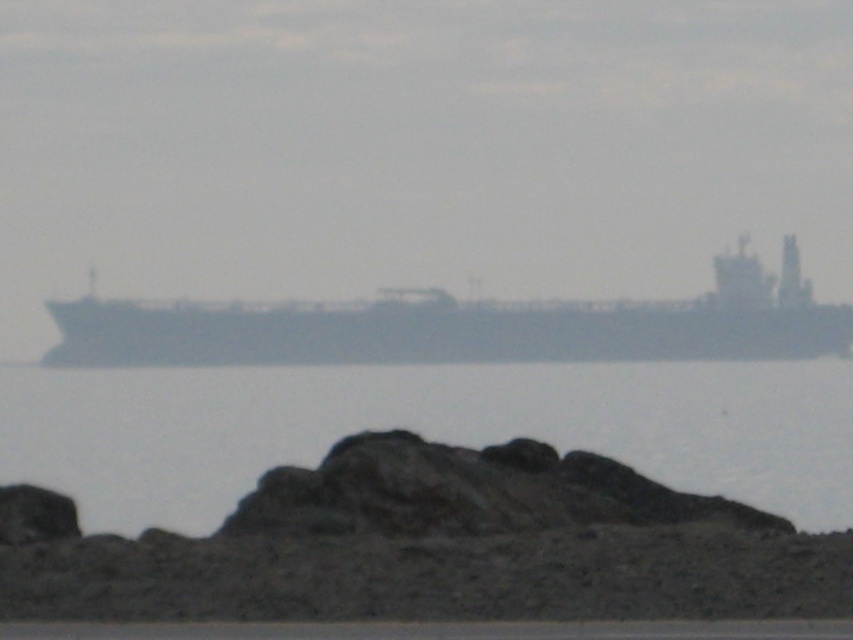
You are an observer standing on the shore looking at the gray matte ship at center and the transparent water at center. Which object appears closer to you?

The transparent water at center appears closer to you because it is shorter than the gray matte ship at center, making it seem nearer in the visual perspective.

You are standing on the ship and looking towards the point marked at coordinates (422, 428). What do you see at that location?

The point at coordinates (422, 428) indicates transparent water at center, so you see transparent water at that location.

You are standing at the point marked as point (816, 529) on the edge of the gravel pile. You want to walk to the ship in the background. Can you see the ship from your current position?

Yes, because the point (816, 529) is 15.65 meters away from the viewer, so the viewer can see the ship in the background from that position.